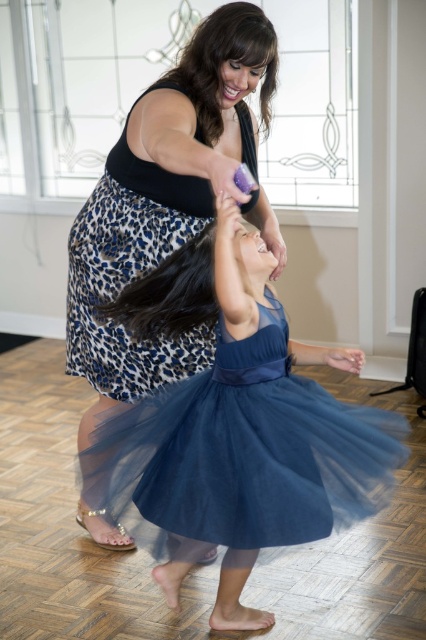
Question: Which point is closer to the camera taking this photo?

Choices:
 (A) click(x=149, y=300)
 (B) click(x=189, y=52)

Answer: (A)

Question: Can you confirm if navy tulle dress at center is wider than leopard print skirt at center?

Choices:
 (A) yes
 (B) no

Answer: (A)

Question: Is navy tulle dress at center bigger than leopard print skirt at center?

Choices:
 (A) no
 (B) yes

Answer: (A)

Question: Which point appears farthest from the camera in this image?

Choices:
 (A) (236, 3)
 (B) (319, 413)

Answer: (A)

Question: Does navy tulle dress at center come in front of leopard print skirt at center?

Choices:
 (A) no
 (B) yes

Answer: (A)